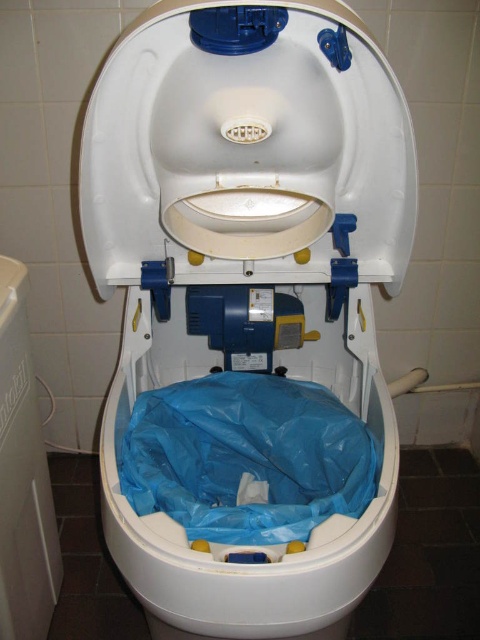
Between white plastic toilet seat at center and blue plastic bag at center, which one has less height?

blue plastic bag at center

Between white plastic toilet seat at center and blue plastic bag at center, which one appears on the left side from the viewer's perspective?

Positioned to the left is blue plastic bag at center.

What do you see at coordinates (247, 150) in the screenshot?
I see `white plastic toilet seat at center` at bounding box center [247, 150].

This screenshot has width=480, height=640. I want to click on white plastic toilet seat at center, so click(x=247, y=150).

Who is more forward, (175, 22) or (201, 440)?

Positioned in front is point (175, 22).

Does white plastic toilet at center have a lesser width compared to blue plastic bag at center?

Incorrect, white plastic toilet at center's width is not less than blue plastic bag at center's.

Image resolution: width=480 pixels, height=640 pixels. What do you see at coordinates (248, 275) in the screenshot? I see `white plastic toilet at center` at bounding box center [248, 275].

This screenshot has height=640, width=480. Identify the location of white plastic toilet at center. (248, 275).

Is white plastic toilet at center bigger than white plastic toilet seat at center?

Yes.

Between white plastic toilet at center and white plastic toilet seat at center, which one has more height?

With more height is white plastic toilet at center.

Who is more distant from viewer, (x=178, y=17) or (x=307, y=48)?

Positioned behind is point (x=307, y=48).

Find the location of a particular element. white plastic toilet at center is located at coordinates (248, 275).